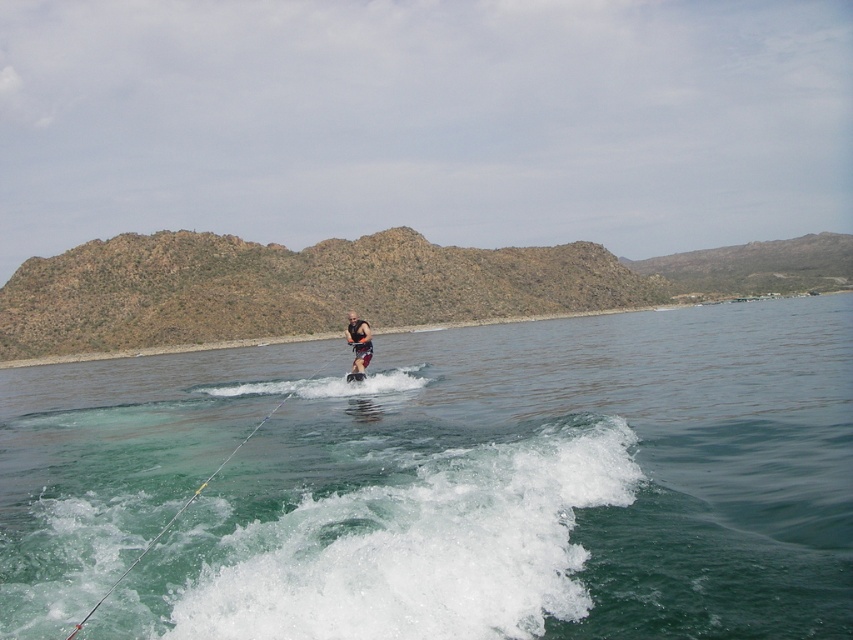
Question: Is the position of white frothy water at lower center less distant than that of orange life vest at center?

Choices:
 (A) no
 (B) yes

Answer: (B)

Question: Is clear water at center further to camera compared to metallic silver rope at lower center?

Choices:
 (A) no
 (B) yes

Answer: (B)

Question: Estimate the real-world distances between objects in this image. Which object is closer to the clear water at center?

Choices:
 (A) orange life vest at center
 (B) white frothy water at lower center

Answer: (B)

Question: Which of the following is the closest to the observer?

Choices:
 (A) (283, 397)
 (B) (201, 572)

Answer: (B)

Question: Which point is farther to the camera?

Choices:
 (A) orange life vest at center
 (B) clear water at center
 (C) metallic silver rope at lower center
 (D) white frothy water at lower center

Answer: (A)

Question: Does clear water at center appear on the left side of white frothy water at lower center?

Choices:
 (A) yes
 (B) no

Answer: (B)